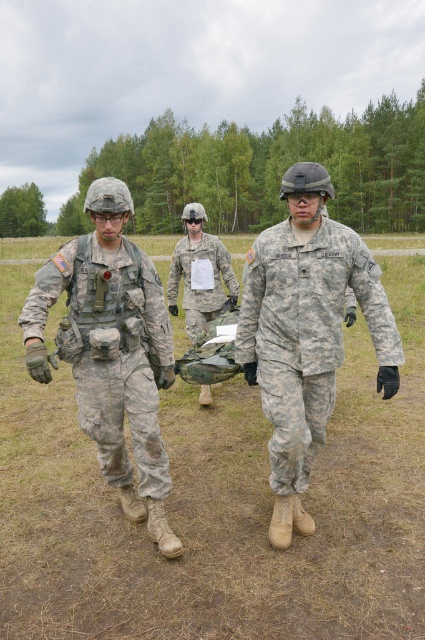
Who is lower down, camouflage uniform at left or camouflage fabric bag at center?

camouflage uniform at left is below.

Between camouflage uniform at left and camouflage fabric bag at center, which one appears on the right side from the viewer's perspective?

camouflage fabric bag at center

Is point (142, 296) more distant than point (178, 284)?

No, (142, 296) is in front of (178, 284).

Locate an element on the screen. This screenshot has height=640, width=425. camouflage uniform at left is located at coordinates (110, 349).

Which is behind, point (300, 204) or point (25, 339)?

Point (300, 204)

Which is in front, point (282, 531) or point (45, 273)?

Point (45, 273) is in front.

Locate an element on the screen. This screenshot has width=425, height=640. camouflage uniform at center is located at coordinates (306, 332).

Between camouflage uniform at center and camouflage fabric bag at center, which one is positioned lower?

Positioned lower is camouflage uniform at center.

Is camouflage uniform at center behind camouflage fabric bag at center?

That is False.

Is point (323, 321) positioned after point (175, 310)?

That is False.

Image resolution: width=425 pixels, height=640 pixels. I want to click on camouflage uniform at center, so click(x=306, y=332).